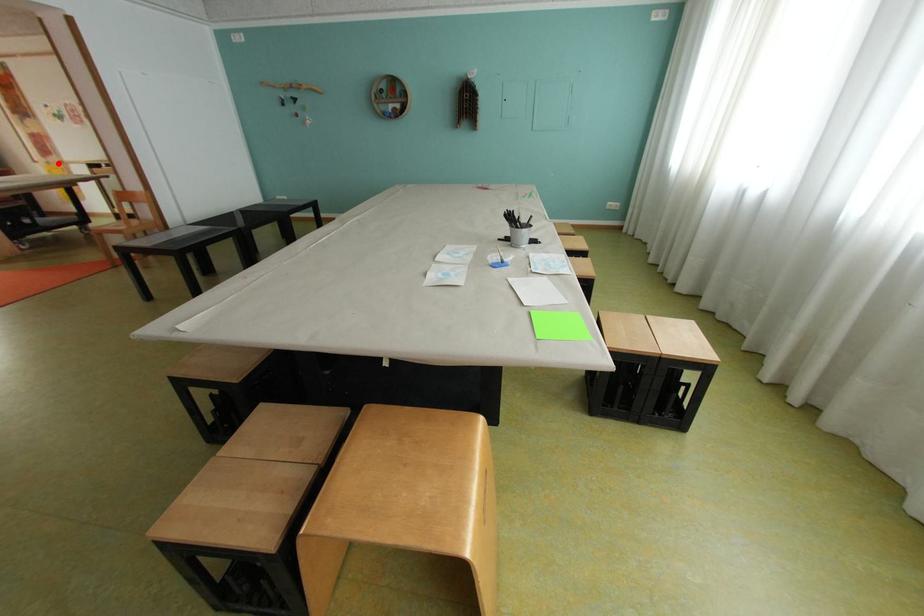
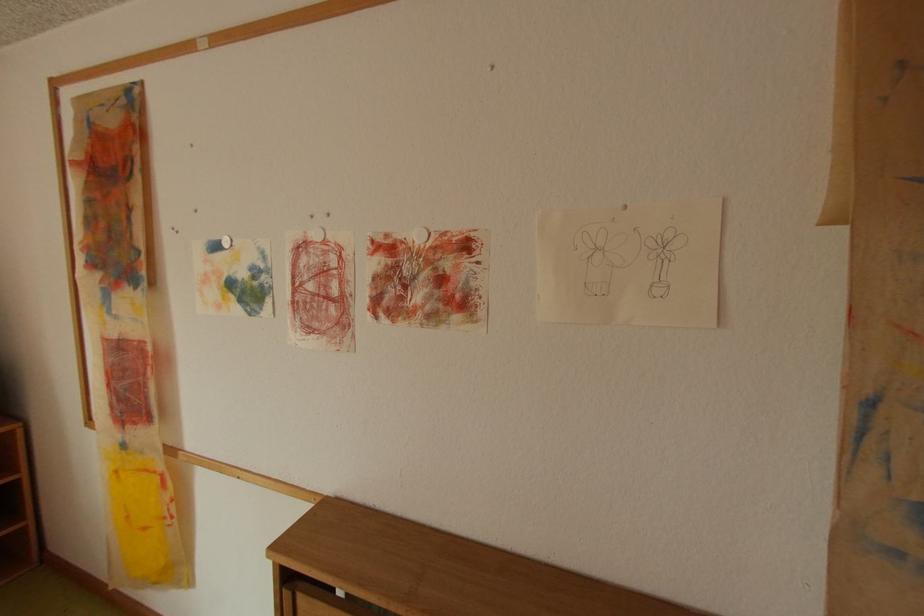
Question: I am providing you with two images of the same scene from different viewpoints. A red point is shown in image1. For the corresponding object point in image2, is it positioned nearer or farther from the camera?

Choices:
 (A) Nearer
 (B) Farther

Answer: (A)